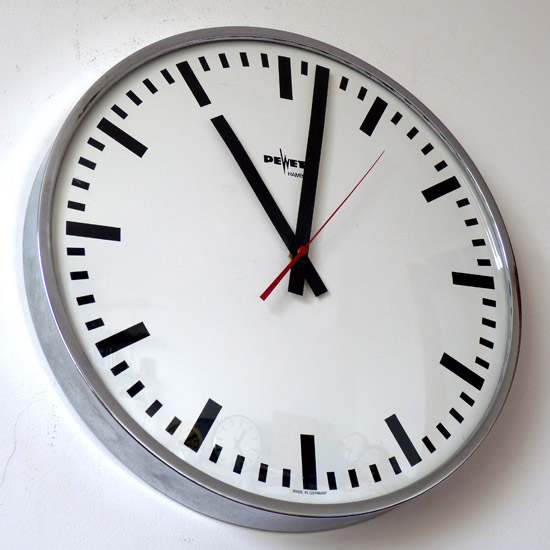
This screenshot has width=550, height=550. What are the coordinates of `glass` in the screenshot? It's located at (192, 336).